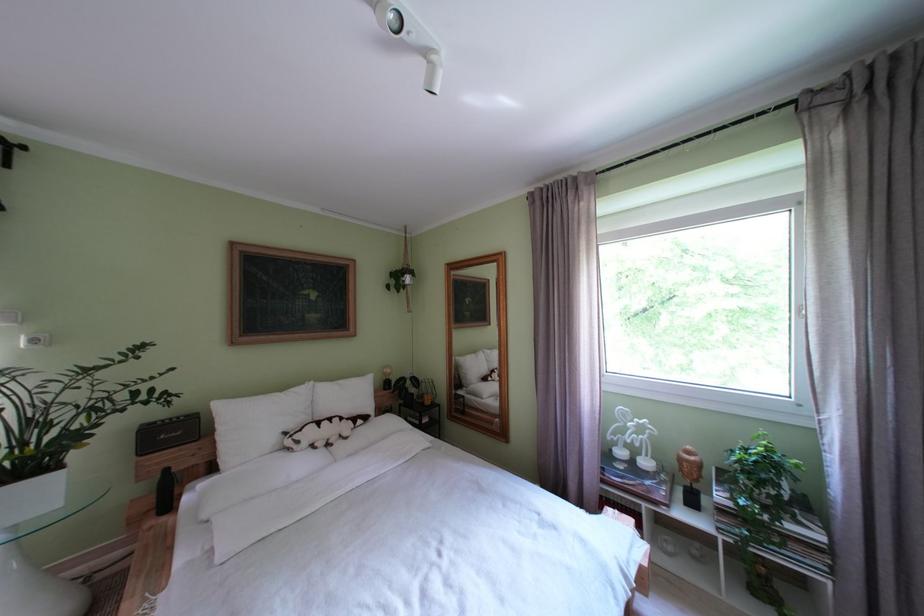
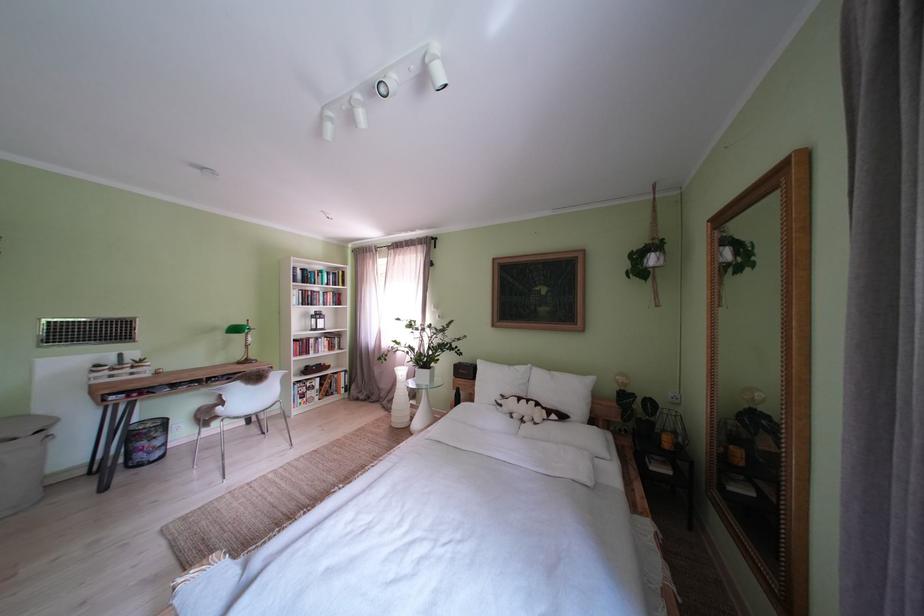
The point at (x=322, y=387) is marked in the first image. Where is the corresponding point in the second image?

(541, 371)